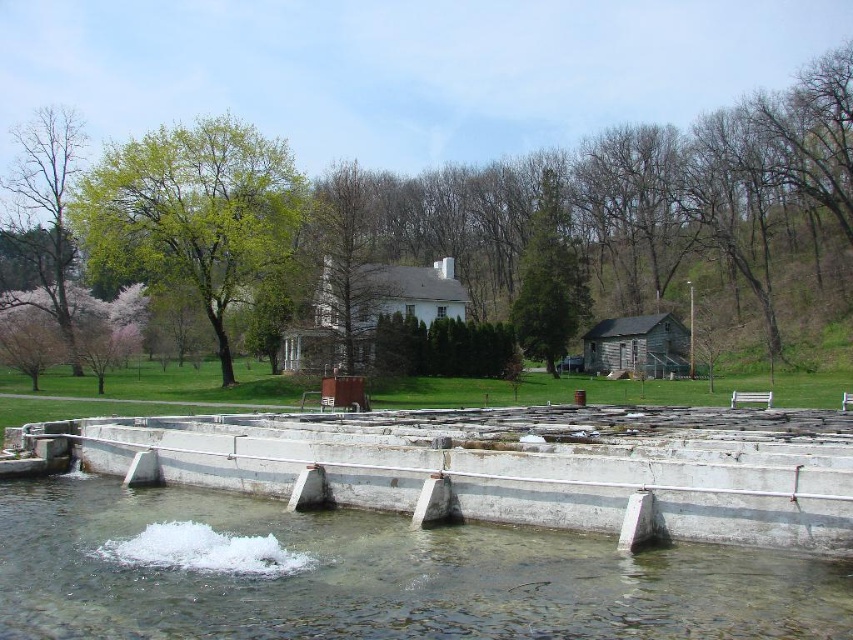
You are a maintenance worker at the fish hatchery. You need to determine which of the two objects, the clear concrete water at center or the white concrete dam at lower center, requires immediate attention based on their sizes. Which one should you prioritize?

The white concrete dam at lower center should be prioritized because it has a larger size compared to the clear concrete water at center, making it more critical for structural integrity and water flow management.

You are standing at the edge of the concrete structure in the fish hatchery and notice a point marked at coordinates (370,576). What does this point represent in the scene?

The point at coordinates (370,576) indicates clear concrete water at center.

You are a maintenance worker at the fish hatchery. You need to check the water level in the clear concrete water at center and the white concrete dam at lower center. Which one has a lower water level?

The clear concrete water at center has a lower water level than the white concrete dam at lower center because it is shorter.